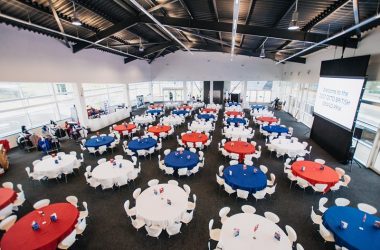
Where is `clothing racks`? The height and width of the screenshot is (250, 380). clothing racks is located at coordinates click(x=24, y=136), click(x=46, y=142), click(x=64, y=133), click(x=75, y=133).